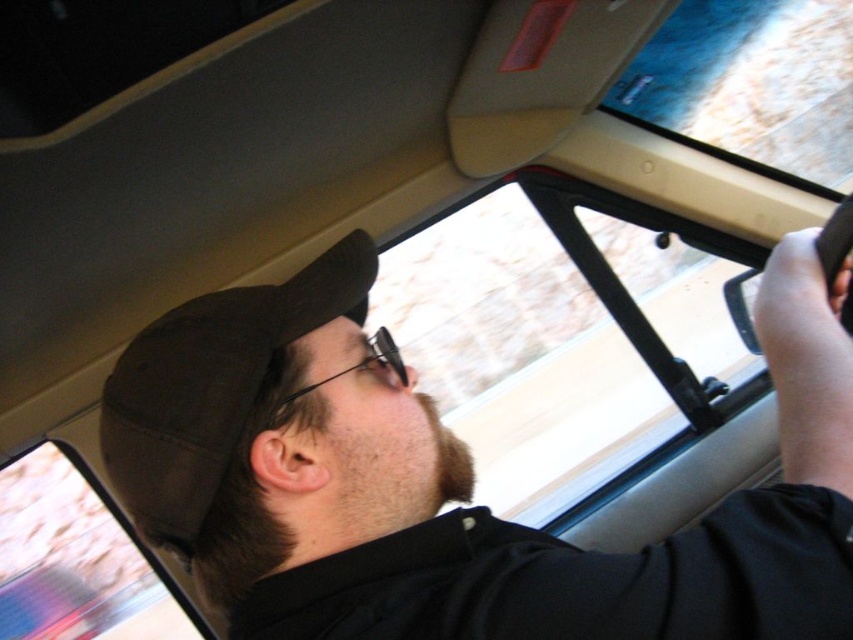
You are a photographer trying to capture a clear image through the window of the vehicle. You notice two items at the upper left corner of your viewfinder. Which item is wider between the black matte cap at upper left and the black fabric baseball hat at upper left?

The black matte cap at upper left is wider than the black fabric baseball hat at upper left according to the description.

You are a photographer trying to capture the perfect shot. You notice two items at the upper left corner of your viewfinder. Which one has a taller profile, the black matte cap at upper left or the black fabric baseball hat at upper left?

The black matte cap at upper left has a greater height compared to the black fabric baseball hat at upper left, so the black matte cap at upper left is taller.

You are a passenger in the vehicle and want to adjust your hat. Which object is closer to you, the black matte cap at upper left or the black fabric baseball hat at upper left?

The black matte cap at upper left is closer to you because it is in front of the black fabric baseball hat at upper left.